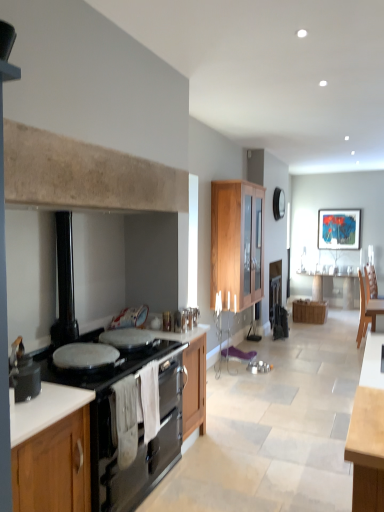
Question: Is black enamel stove at left shorter than wooden cabinet at lower left, which is the third cabinetry in right-to-left order?

Choices:
 (A) no
 (B) yes

Answer: (B)

Question: Does black enamel stove at left have a smaller size compared to wooden cabinet at lower left, which is the third cabinetry in right-to-left order?

Choices:
 (A) no
 (B) yes

Answer: (B)

Question: From a real-world perspective, is black enamel stove at left beneath wooden cabinet at lower left, the 1th cabinetry when ordered from left to right?

Choices:
 (A) no
 (B) yes

Answer: (A)

Question: Considering the relative positions of black enamel stove at left and wooden cabinet at lower left, which is the third cabinetry in right-to-left order, in the image provided, is black enamel stove at left behind wooden cabinet at lower left, which is the third cabinetry in right-to-left order,?

Choices:
 (A) no
 (B) yes

Answer: (B)

Question: Is black enamel stove at left thinner than wooden cabinet at lower left, which is the third cabinetry in right-to-left order?

Choices:
 (A) yes
 (B) no

Answer: (A)

Question: Is wooden cabinet at lower left, which is the 3th cabinetry in top-to-bottom order, wider or thinner than metallic glossy picture frame at upper right?

Choices:
 (A) wide
 (B) thin

Answer: (A)

Question: Relative to metallic glossy picture frame at upper right, is wooden cabinet at lower left, marked as the first cabinetry in a front-to-back arrangement, in front or behind?

Choices:
 (A) behind
 (B) front

Answer: (B)

Question: Is wooden cabinet at lower left, the 1th cabinetry when ordered from left to right, inside the boundaries of metallic glossy picture frame at upper right, or outside?

Choices:
 (A) inside
 (B) outside

Answer: (B)

Question: Considering the positions of point (33, 489) and point (317, 247), is point (33, 489) closer or farther from the camera than point (317, 247)?

Choices:
 (A) closer
 (B) farther

Answer: (A)

Question: Is point (21, 385) closer or farther from the camera than point (263, 281)?

Choices:
 (A) closer
 (B) farther

Answer: (A)

Question: From the image's perspective, is matte black pot at left above or below wooden cabinet at center, marked as the 2th cabinetry in a back-to-front arrangement?

Choices:
 (A) below
 (B) above

Answer: (A)

Question: Choose the correct answer: Is matte black pot at left inside wooden cabinet at center, which appears as the third cabinetry when ordered from the bottom, or outside it?

Choices:
 (A) outside
 (B) inside

Answer: (A)

Question: From a real-world perspective, is matte black pot at left above or below wooden cabinet at center, which is counted as the 2th cabinetry, starting from the front?

Choices:
 (A) below
 (B) above

Answer: (A)

Question: Looking at their shapes, would you say wooden cabinet at center, which ranks as the 2th cabinetry in left-to-right order, is wider or thinner than black enamel stove at left?

Choices:
 (A) wide
 (B) thin

Answer: (B)

Question: In terms of height, does wooden cabinet at center, which appears as the third cabinetry when ordered from the bottom, look taller or shorter compared to black enamel stove at left?

Choices:
 (A) tall
 (B) short

Answer: (A)